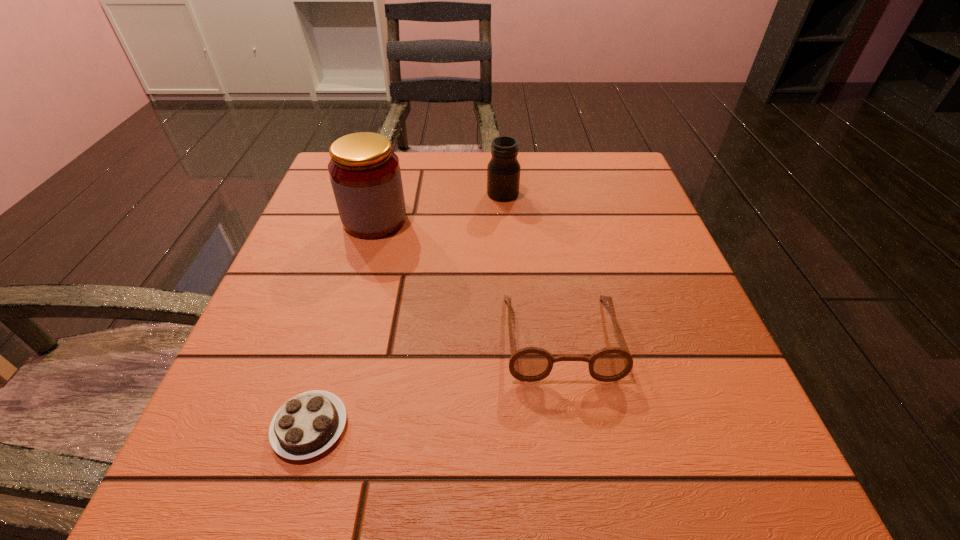
The height and width of the screenshot is (540, 960). In the image, there is a desktop. In order to click on vacant area at the right edge in this screenshot , I will do `click(688, 410)`.

At what (x,y) coordinates should I click in order to perform the action: click on vacant region at the far left corner of the desktop. Please return your answer as a coordinate pair (x, y). This screenshot has height=540, width=960. Looking at the image, I should click on (325, 197).

You are a GUI agent. You are given a task and a screenshot of the screen. Output one action in this format:
    pyautogui.click(x=<x>, y=<y>)
    Task: Click on the vacant space at the near left corner
    The height and width of the screenshot is (540, 960).
    Given the screenshot: What is the action you would take?
    pyautogui.click(x=212, y=484)

This screenshot has height=540, width=960. In order to click on free region at the far right corner of the desktop in this screenshot , I will do `click(600, 169)`.

Locate an element on the screen. free space at the near right corner of the desktop is located at coordinates (638, 446).

You are a GUI agent. You are given a task and a screenshot of the screen. Output one action in this format:
    pyautogui.click(x=<x>, y=<y>)
    Task: Click on the free spot between the right jar and the chocolate cake
    
    Given the screenshot: What is the action you would take?
    pyautogui.click(x=406, y=310)

Locate an element on the screen. This screenshot has width=960, height=540. free space between the spectacles and the chocolate cake is located at coordinates (435, 382).

At what (x,y) coordinates should I click in order to perform the action: click on vacant space that is in between the third farthest object and the taller jar. Please return your answer as a coordinate pair (x, y). Looking at the image, I should click on (468, 278).

The width and height of the screenshot is (960, 540). In order to click on vacant region between the shortest object and the second tallest object in this screenshot , I will do point(406,310).

The image size is (960, 540). I want to click on vacant point located between the chocolate cake and the taller jar, so click(x=343, y=323).